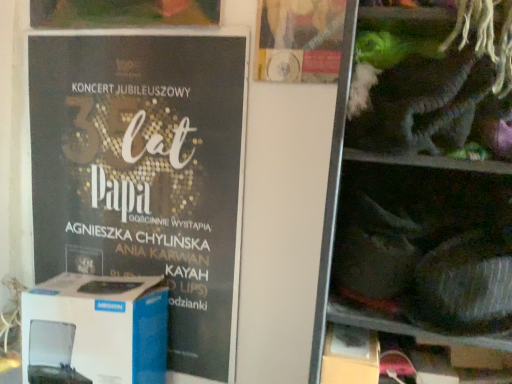
Describe the element at coordinates (298, 40) in the screenshot. The image size is (512, 384). I see `matte gold poster at upper center` at that location.

This screenshot has height=384, width=512. I want to click on white cardboard box at left, so click(x=95, y=330).

Where is `matte gold poster at upper center`? The height and width of the screenshot is (384, 512). matte gold poster at upper center is located at coordinates (298, 40).

Is matte black poster at left facing away from matte gold poster at upper center?

matte black poster at left is not turned away from matte gold poster at upper center.

The width and height of the screenshot is (512, 384). What are the coordinates of `poster below the matte gold poster at upper center (from a real-world perspective)` in the screenshot? It's located at (144, 174).

Can you confirm if matte black poster at left is wider than matte gold poster at upper center?

Yes.

Which is in front, point (149, 152) or point (312, 73)?

The point (312, 73) is in front.

From the image's perspective, which object appears higher, matte black poster at left or white cardboard box at left?

matte black poster at left, from the image's perspective.

Is matte black poster at left looking in the opposite direction of white cardboard box at left?

Yes, matte black poster at left is facing away from white cardboard box at left.

Identify the location of poster above the white cardboard box at left (from a real-world perspective). This screenshot has height=384, width=512. (144, 174).

Is white cardboard box at left completely or partially inside matte black poster at left?

No, white cardboard box at left is not a part of matte black poster at left.

Between shiny plastic toys at right and white cardboard box at left, which one has smaller width?

white cardboard box at left is thinner.

Is shiny plastic toys at right located outside white cardboard box at left?

Indeed, shiny plastic toys at right is completely outside white cardboard box at left.

Where is `box below the shiny plastic toys at right (from a real-world perspective)`? box below the shiny plastic toys at right (from a real-world perspective) is located at coordinates (95, 330).

Considering the sizes of objects shiny plastic toys at right and white cardboard box at left in the image provided, who is taller, shiny plastic toys at right or white cardboard box at left?

shiny plastic toys at right is taller.

Is matte gold poster at upper center facing towards white cardboard box at left?

No, matte gold poster at upper center is not turned towards white cardboard box at left.

Based on the photo, considering the positions of objects matte gold poster at upper center and white cardboard box at left in the image provided, who is more to the left, matte gold poster at upper center or white cardboard box at left?

white cardboard box at left.

Is matte gold poster at upper center positioned beyond the bounds of white cardboard box at left?

Absolutely, matte gold poster at upper center is external to white cardboard box at left.

Looking at the image, does matte gold poster at upper center seem bigger or smaller compared to white cardboard box at left?

matte gold poster at upper center is smaller than white cardboard box at left.

Does matte gold poster at upper center come behind shiny plastic toys at right?

Yes, matte gold poster at upper center is further from the camera.

Is matte gold poster at upper center taller or shorter than shiny plastic toys at right?

matte gold poster at upper center is shorter than shiny plastic toys at right.

From the image's perspective, is matte gold poster at upper center under shiny plastic toys at right?

Incorrect, from the image's perspective, matte gold poster at upper center is higher than shiny plastic toys at right.

Between matte gold poster at upper center and shiny plastic toys at right, which one has larger width?

Wider between the two is shiny plastic toys at right.

Is shiny plastic toys at right at the back of white cardboard box at left?

That's not correct — white cardboard box at left is not looking away from shiny plastic toys at right.

Is white cardboard box at left positioned before shiny plastic toys at right?

No, white cardboard box at left is further to the viewer.

Between point (97, 342) and point (389, 274), which one is positioned in front?

The point (389, 274) is more forward.

What's the angular difference between white cardboard box at left and matte black poster at left's facing directions?

The facing directions of white cardboard box at left and matte black poster at left are 0.00015 degrees apart.

From the image's perspective, is white cardboard box at left below matte black poster at left?

Yes.

From a real-world perspective, who is located lower, white cardboard box at left or matte black poster at left?

white cardboard box at left.

Is point (58, 276) positioned after point (30, 61)?

Yes, point (58, 276) is behind point (30, 61).

Where is `flyer in front of the matte black poster at left`? flyer in front of the matte black poster at left is located at coordinates tap(298, 40).

Find the location of a particular element. Image resolution: width=512 pixels, height=384 pixels. poster located behind the white cardboard box at left is located at coordinates (144, 174).

Based on their spatial positions, is matte gold poster at upper center or shiny plastic toys at right closer to matte black poster at left?

The object closer to matte black poster at left is matte gold poster at upper center.

From the image, which object appears to be farther from shiny plastic toys at right, white cardboard box at left or matte gold poster at upper center?

Based on the image, white cardboard box at left appears to be further to shiny plastic toys at right.

Considering their positions, is matte black poster at left positioned closer to shiny plastic toys at right than white cardboard box at left?

matte black poster at left is closer to shiny plastic toys at right.

Which object lies further to the anchor point matte gold poster at upper center, matte black poster at left or white cardboard box at left?

The object further to matte gold poster at upper center is white cardboard box at left.

When comparing their distances from matte gold poster at upper center, does white cardboard box at left or shiny plastic toys at right seem closer?

Based on the image, shiny plastic toys at right appears to be nearer to matte gold poster at upper center.

Looking at the image, which one is located further to matte black poster at left, shiny plastic toys at right or matte gold poster at upper center?

Among the two, shiny plastic toys at right is located further to matte black poster at left.

Estimate the real-world distances between objects in this image. Which object is closer to shiny plastic toys at right, white cardboard box at left or matte black poster at left?

Among the two, matte black poster at left is located nearer to shiny plastic toys at right.

When comparing their distances from matte gold poster at upper center, does shiny plastic toys at right or white cardboard box at left seem closer?

Based on the image, shiny plastic toys at right appears to be nearer to matte gold poster at upper center.

Identify the location of shelf between matte gold poster at upper center and white cardboard box at left in the vertical direction. (423, 173).

Identify the location of flyer between matte black poster at left and shiny plastic toys at right. Image resolution: width=512 pixels, height=384 pixels. (298, 40).

Where is `poster between matte gold poster at upper center and white cardboard box at left in the up-down direction`? The height and width of the screenshot is (384, 512). poster between matte gold poster at upper center and white cardboard box at left in the up-down direction is located at coordinates (144, 174).

Identify the location of poster located between white cardboard box at left and shiny plastic toys at right in the left-right direction. (144, 174).